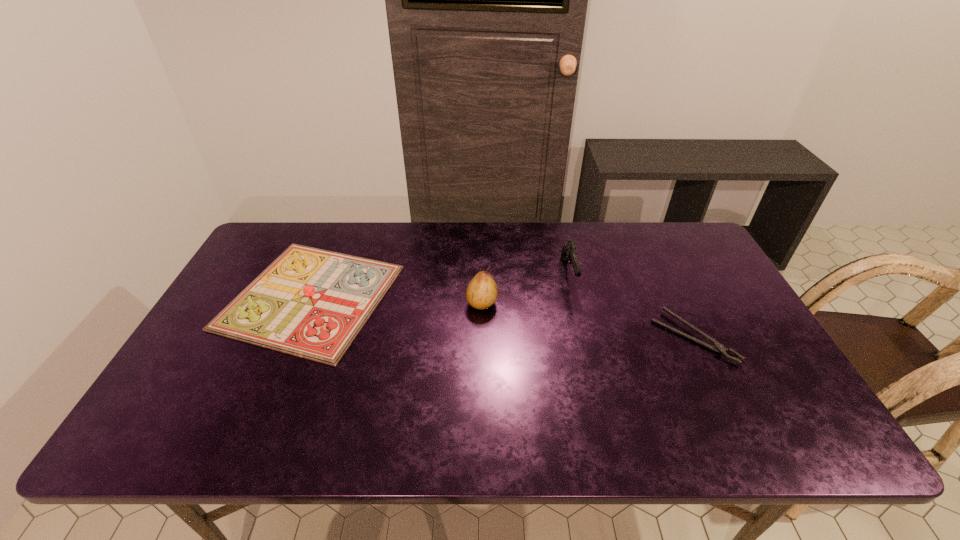
At what (x,y) coordinates should I click in order to perform the action: click on the second object from left to right. Please return your answer as a coordinate pair (x, y). Looking at the image, I should click on (482, 292).

This screenshot has width=960, height=540. I want to click on the third object from left to right, so click(569, 253).

You are a GUI agent. You are given a task and a screenshot of the screen. Output one action in this format:
    pyautogui.click(x=<x>, y=<y>)
    Task: Click on the gameboard
    The height and width of the screenshot is (540, 960).
    Given the screenshot: What is the action you would take?
    pyautogui.click(x=312, y=303)

The image size is (960, 540). What are the coordinates of `the second shortest object` in the screenshot? It's located at (312, 303).

Where is `tongs`? Image resolution: width=960 pixels, height=540 pixels. tongs is located at coordinates (719, 348).

Where is `the shortest object`? The image size is (960, 540). the shortest object is located at coordinates (719, 348).

At what (x,y) coordinates should I click in order to perform the action: click on blank space located on the back of the pear. Please return your answer as a coordinate pair (x, y). Looking at the image, I should click on (482, 240).

Identify the location of vacant space situated 0.250m at the end of the barrel of the gun. This screenshot has width=960, height=540. (590, 367).

Where is `free space located 0.070m on the front of the leftmost object`? free space located 0.070m on the front of the leftmost object is located at coordinates (272, 390).

This screenshot has height=540, width=960. Find the location of `free point located 0.310m on the left of the tongs`. free point located 0.310m on the left of the tongs is located at coordinates (540, 337).